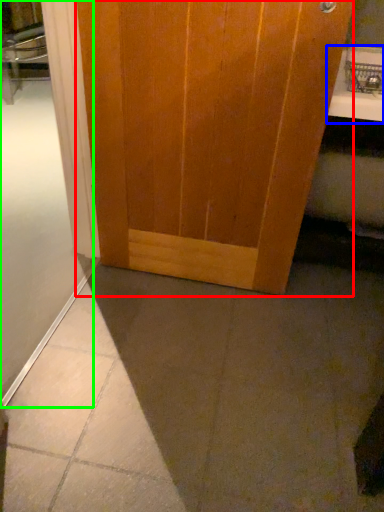
Question: Based on their relative distances, which object is nearer to door (highlighted by a red box)? Choose from counter top (highlighted by a blue box) and shower door (highlighted by a green box).

Choices:
 (A) counter top
 (B) shower door

Answer: (B)